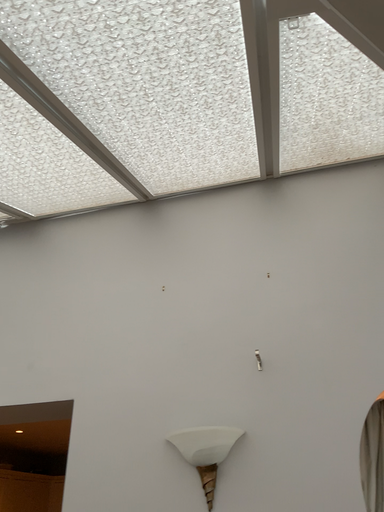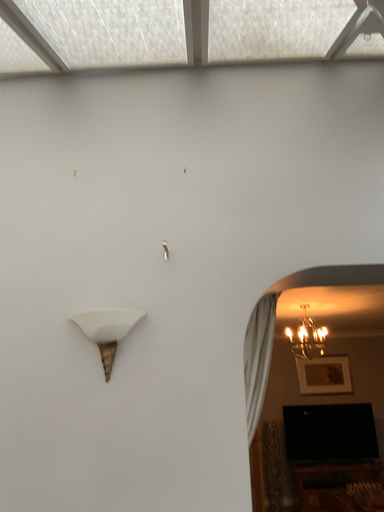
Question: How did the camera likely rotate when shooting the video?

Choices:
 (A) rotated right
 (B) rotated left

Answer: (A)